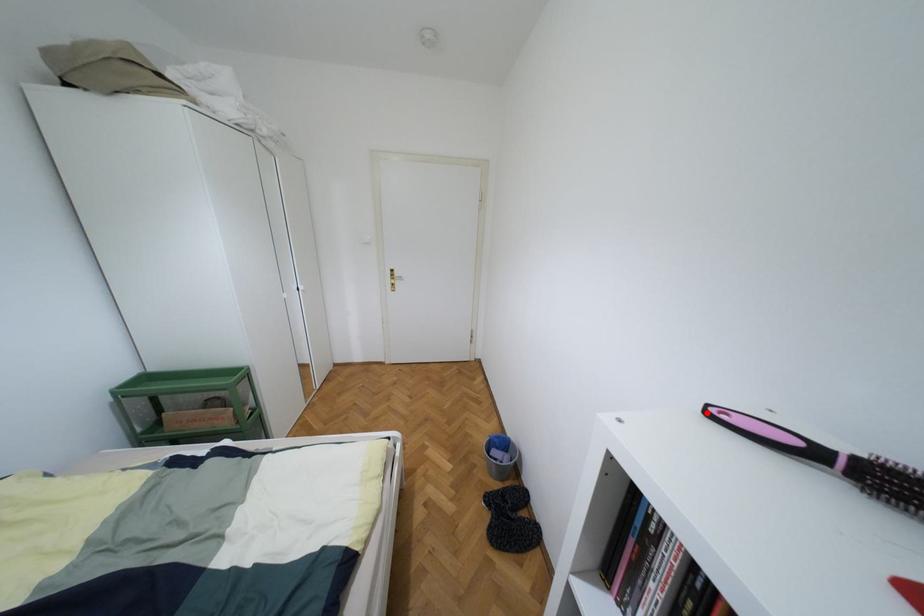
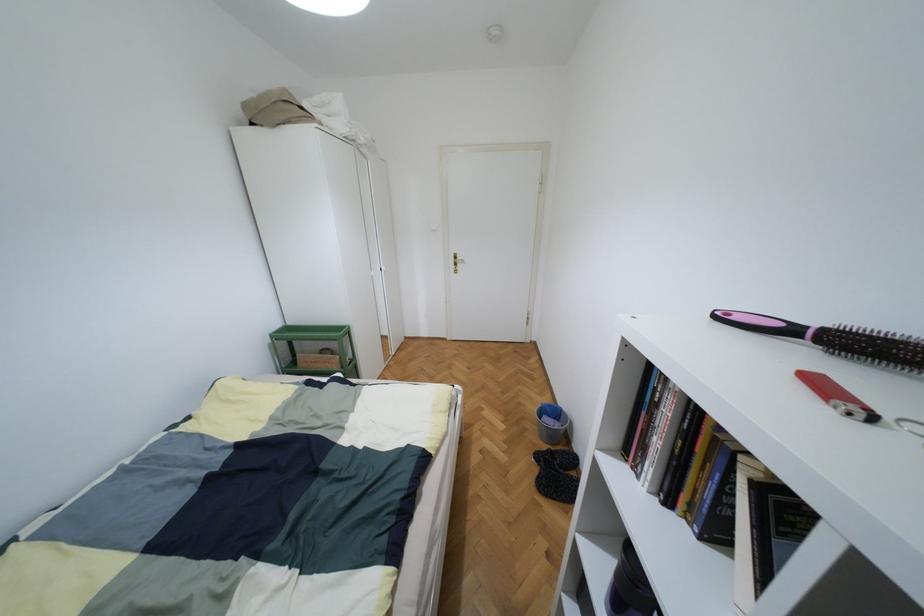
The point at the highlighted location is marked in the first image. Where is the corresponding point in the second image?

(713, 315)